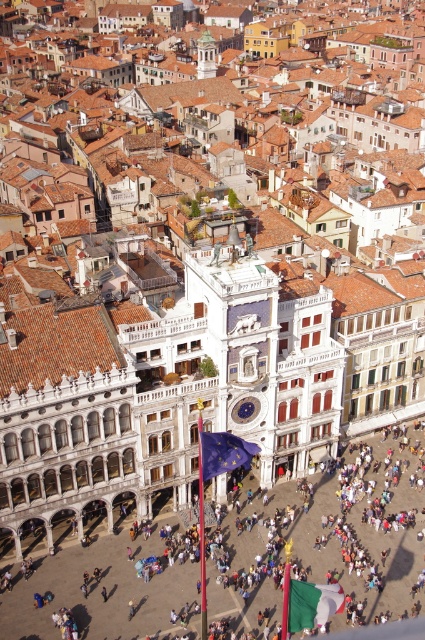
Question: Does white stone flagpole at center appear on the left side of white marble clock tower at center?

Choices:
 (A) no
 (B) yes

Answer: (A)

Question: Can you confirm if white stone flagpole at center is positioned to the left of gold textured dome at center?

Choices:
 (A) yes
 (B) no

Answer: (B)

Question: Estimate the real-world distances between objects in this image. Which object is farther from the white marble clock tower at center?

Choices:
 (A) gold textured dome at center
 (B) white stone flagpole at center

Answer: (A)

Question: Which of the following is the closest to the observer?

Choices:
 (A) gold textured dome at center
 (B) white marble clock tower at center

Answer: (B)

Question: Does white stone flagpole at center have a greater width compared to gold textured dome at center?

Choices:
 (A) yes
 (B) no

Answer: (A)

Question: Which object is the farthest from the white marble clock tower at center?

Choices:
 (A) white stone flagpole at center
 (B) gold textured dome at center

Answer: (B)